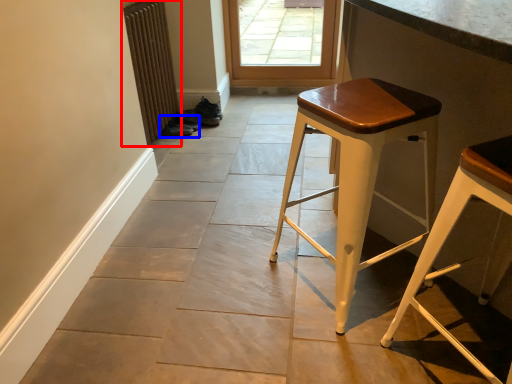
Question: Which of the following is the closest to the observer, radiator (highlighted by a red box) or shoe (highlighted by a blue box)?

Choices:
 (A) radiator
 (B) shoe

Answer: (A)